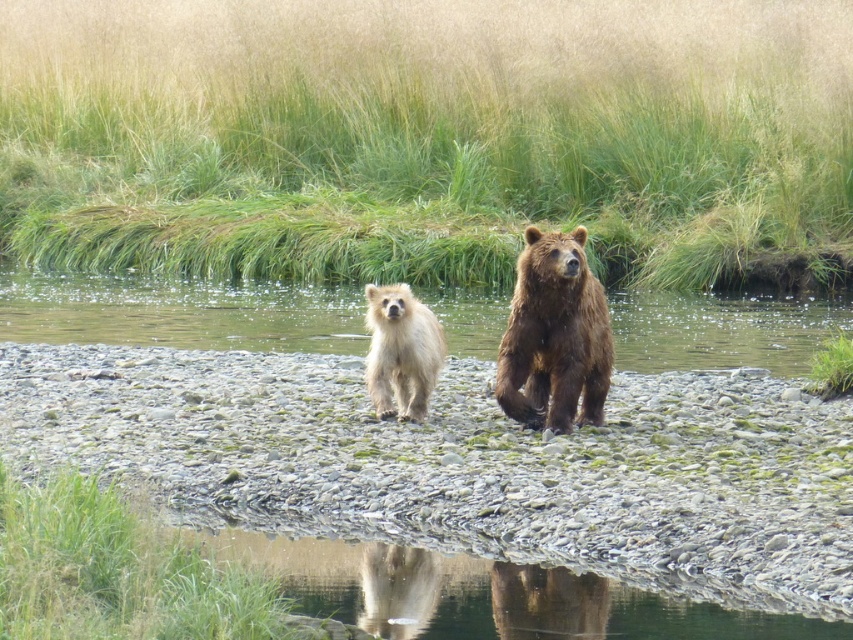
You are a photographer trying to capture a clear shot of both the green mossy rocks at center and the brown furry bear at center. Since you want both subjects to be in focus, you need to adjust your camera settings. Which subject is shorter and requires closer attention to ensure it isn not blurred?

The green mossy rocks at center has a lesser height compared to the brown furry bear at center, so you should focus on the green mossy rocks at center first to ensure it is in focus.

You are a photographer trying to capture the two animals on the green mossy rocks at center and the brown fur river at center. Which object is narrower in width?

The green mossy rocks at center has a lesser width compared to the brown fur river at center, so the green mossy rocks at center is narrower in width.

You are a photographer trying to capture the perfect shot of the brown furry bear at center. Based on the coordinates provided, where should you aim your camera to ensure the bear is centered in your frame?

The brown furry bear at center is positioned at coordinates point (554, 337), so you should aim your camera at that point to center the bear in your frame.